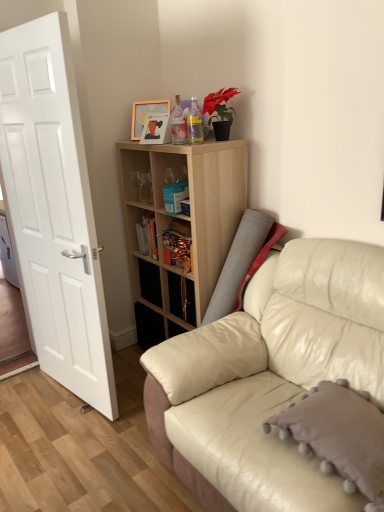
Question: From the image's perspective, is translucent plastic bottle at upper center, which is the 2th bottle in right-to-left order, positioned above or below hardcover book at center, the 1th book in the back-to-front sequence?

Choices:
 (A) below
 (B) above

Answer: (B)

Question: Is translucent plastic bottle at upper center, the 1th bottle positioned from the left, bigger or smaller than hardcover book at center, which is counted as the 1th book, starting from the left?

Choices:
 (A) big
 (B) small

Answer: (A)

Question: Estimate the real-world distances between objects in this image. Which object is farther from the blue matte bookshelf at center, the first book viewed from the right?

Choices:
 (A) leather couch at right
 (B) white matte door at left
 (C) hardcover book at center, the 1th book positioned from the bottom
 (D) light wood/texture bookshelf at upper center
 (E) clear glass bottle at upper center, arranged as the 2th bottle when viewed from the left

Answer: (A)

Question: Which object is the closest to the hardcover book at center, the 2th book viewed from the top?

Choices:
 (A) blue matte bookshelf at center, marked as the first book in a front-to-back arrangement
 (B) light wood/texture bookshelf at upper center
 (C) translucent plastic bottle at upper center, the 1th bottle positioned from the left
 (D) black matte drawer at center
 (E) clear glass bottle at upper center, placed as the 1th bottle when sorted from right to left

Answer: (D)